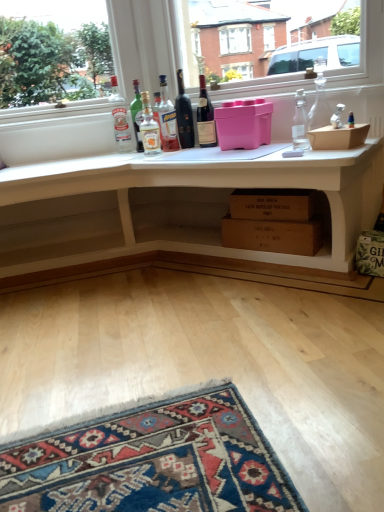
The image size is (384, 512). I want to click on vacant space underneath white matte desk at center (from a real-world perspective), so click(x=160, y=288).